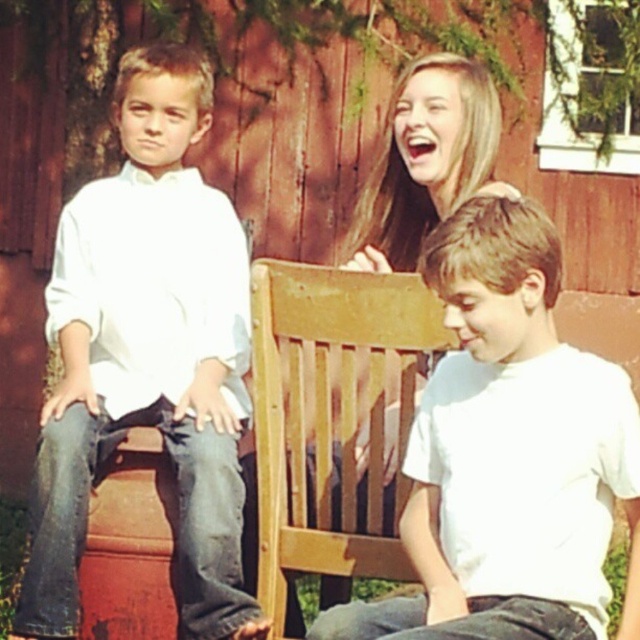
Between point (208, 214) and point (502, 541), which one is positioned in front?

Point (502, 541) is in front.

Is matte white shirt at left positioned before white matte shirt at center?

No, matte white shirt at left is behind white matte shirt at center.

Locate an element on the screen. This screenshot has width=640, height=640. matte white shirt at left is located at coordinates (147, 353).

Locate an element on the screen. Image resolution: width=640 pixels, height=640 pixels. matte white shirt at left is located at coordinates (147, 353).